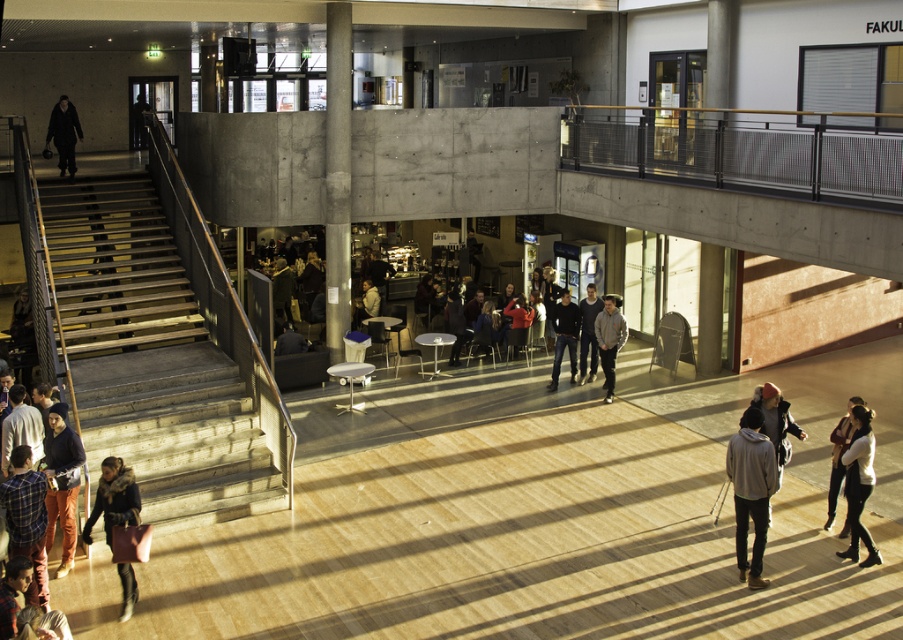
Can you confirm if concrete stairs at left is positioned above white cotton hoodie at lower right?

Correct, concrete stairs at left is located above white cotton hoodie at lower right.

Does concrete stairs at left have a lesser width compared to white cotton hoodie at lower right?

No, concrete stairs at left is not thinner than white cotton hoodie at lower right.

Measure the distance between point (227, 451) and camera.

Point (227, 451) is 11.61 meters from camera.

Locate an element on the screen. concrete stairs at left is located at coordinates (151, 358).

In the scene shown: Is matte black jacket at lower left taller than white cotton hoodie at lower right?

Correct, matte black jacket at lower left is much taller as white cotton hoodie at lower right.

Which is below, matte black jacket at lower left or white cotton hoodie at lower right?

Positioned lower is matte black jacket at lower left.

Find the location of a particular element. Image resolution: width=903 pixels, height=640 pixels. matte black jacket at lower left is located at coordinates (61, 481).

Is gray hoodie at lower right closer to camera compared to velvet brown coat at lower left?

No, gray hoodie at lower right is behind velvet brown coat at lower left.

How distant is gray hoodie at lower right from velvet brown coat at lower left?

The distance of gray hoodie at lower right from velvet brown coat at lower left is 7.47 meters.

Between point (759, 440) and point (128, 604), which one is positioned behind?

The point (759, 440) is more distant.

Locate an element on the screen. gray hoodie at lower right is located at coordinates (751, 490).